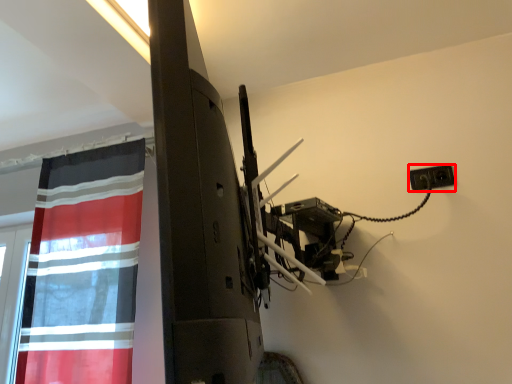
Question: Considering the relative positions of electric outlet (annotated by the red box) and curtain in the image provided, where is electric outlet (annotated by the red box) located with respect to the staircase?

Choices:
 (A) right
 (B) left

Answer: (A)